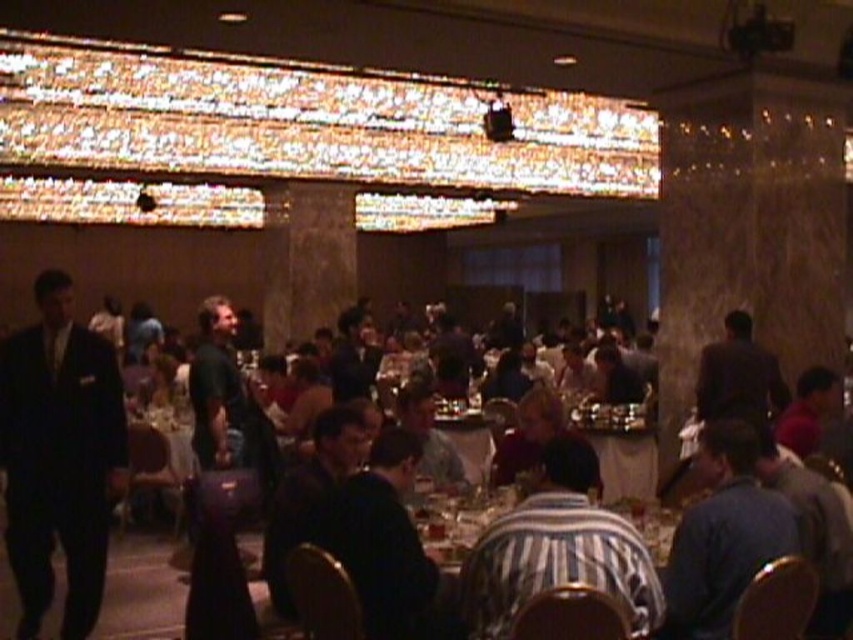
Question: Which of the following is the farthest from the observer?

Choices:
 (A) striped fabric table at center
 (B) striped fabric shirt at center
 (C) black suit at left
 (D) blue fabric shirt at lower right

Answer: (C)

Question: Can you confirm if striped fabric shirt at center is positioned to the left of blue fabric shirt at lower right?

Choices:
 (A) yes
 (B) no

Answer: (A)

Question: Among these points, which one is nearest to the camera?

Choices:
 (A) (544, 506)
 (B) (656, 522)
 (C) (82, 554)

Answer: (A)

Question: Can you confirm if black suit at left is positioned below striped fabric table at center?

Choices:
 (A) no
 (B) yes

Answer: (A)

Question: Considering the relative positions of black suit at left and striped fabric table at center in the image provided, where is black suit at left located with respect to striped fabric table at center?

Choices:
 (A) above
 (B) below

Answer: (A)

Question: Which object is the farthest from the striped fabric table at center?

Choices:
 (A) striped fabric shirt at center
 (B) black suit at left

Answer: (B)